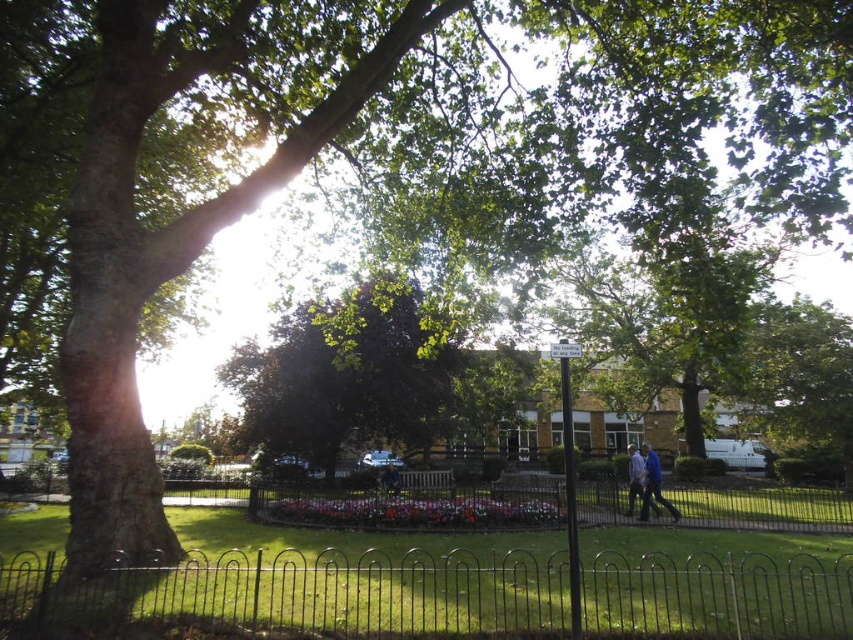
Question: Which object is farther from the camera taking this photo?

Choices:
 (A) blue fabric jacket at lower center
 (B) blue fabric jacket at center
 (C) green leafy tree at center
 (D) black metal fence at lower center

Answer: (A)

Question: Where is green leafy tree at center located in relation to blue fabric jacket at center in the image?

Choices:
 (A) below
 (B) above

Answer: (B)

Question: Does black metal fence at lower center appear on the right side of green leafy tree at center?

Choices:
 (A) yes
 (B) no

Answer: (A)

Question: Can you confirm if blue fabric jacket at center is smaller than blue fabric jacket at lower center?

Choices:
 (A) yes
 (B) no

Answer: (A)

Question: Which of the following is the farthest from the observer?

Choices:
 (A) blue fabric jacket at lower center
 (B) green leafy tree at center
 (C) blue fabric jacket at center
 (D) black metal fence at lower center

Answer: (A)

Question: Which point is closer to the camera?

Choices:
 (A) (265, 596)
 (B) (407, 369)
 (C) (628, 480)

Answer: (A)